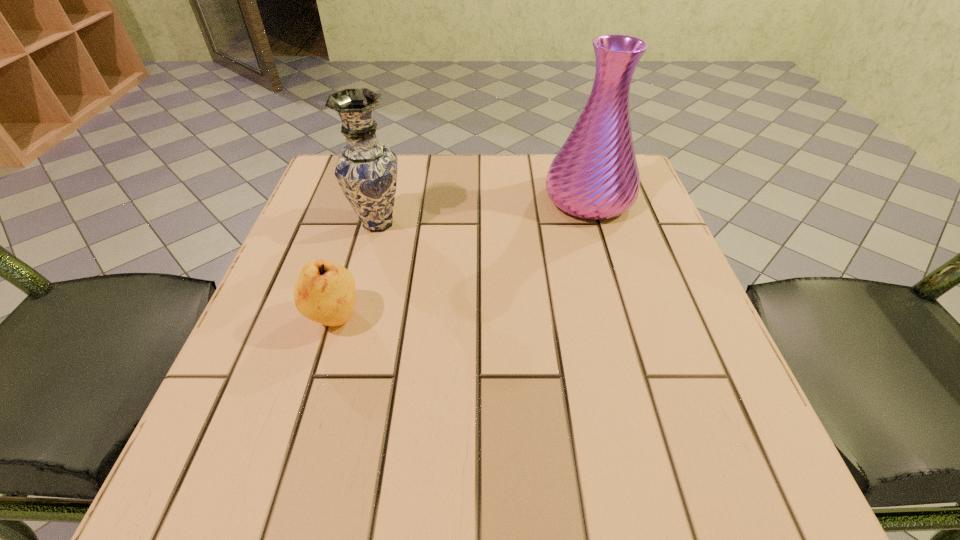
Identify the location of the tallest object. The image size is (960, 540). (595, 175).

This screenshot has height=540, width=960. Find the location of `the right vase`. the right vase is located at coordinates (595, 175).

Locate an element on the screen. This screenshot has width=960, height=540. the second shortest object is located at coordinates (366, 170).

Find the location of `the shorter vase`. the shorter vase is located at coordinates (366, 170).

Where is `pear`? Image resolution: width=960 pixels, height=540 pixels. pear is located at coordinates (325, 292).

You are a GUI agent. You are given a task and a screenshot of the screen. Output one action in this format:
    pyautogui.click(x=<x>, y=<y>)
    Task: Click on the nearest object
    
    Given the screenshot: What is the action you would take?
    coord(325,292)

You are a GUI agent. You are given a task and a screenshot of the screen. Output one action in this format:
    pyautogui.click(x=<x>, y=<y>)
    Task: Click on the free space located on the front of the rightmost object
    
    Given the screenshot: What is the action you would take?
    pyautogui.click(x=610, y=271)

You are a GUI agent. You are given a task and a screenshot of the screen. Output one action in this format:
    pyautogui.click(x=<x>, y=<y>)
    Task: Click on the vacant region located on the back of the second shortest object
    
    Given the screenshot: What is the action you would take?
    pyautogui.click(x=389, y=184)

Image resolution: width=960 pixels, height=540 pixels. What are the coordinates of `vacant space located on the left of the shortest object` in the screenshot? It's located at (266, 319).

At what (x,y) coordinates should I click in order to perform the action: click on vase located at the left edge. Please return your answer as a coordinate pair (x, y). Image resolution: width=960 pixels, height=540 pixels. Looking at the image, I should click on (366, 170).